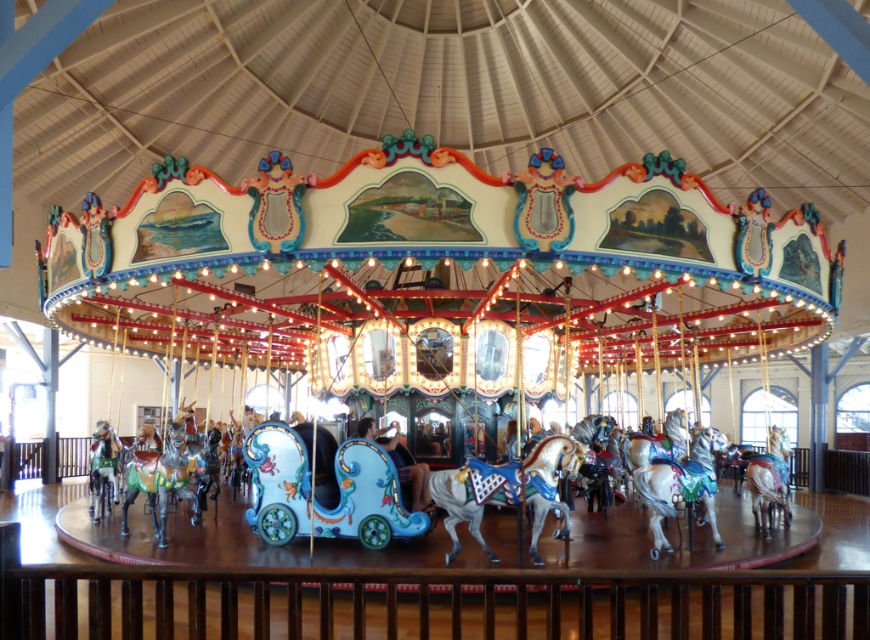
You are a visitor standing at the edge of the carousel, and you want to choose between the shiny silver horse at center and the shiny white horse at center. Which horse do you think has a larger width?

The shiny silver horse at center might be wider than the shiny white horse at center according to the description.

Please describe the object located at point [678,483] in the carousel image.

The object at point [678,483] is a shiny white horse at center.

You are a child who wants to ride the biggest horse on the carousel. Which horse should you choose between the shiny white horse at center and the shiny silver horse at lower left?

The shiny white horse at center is bigger than the shiny silver horse at lower left, so you should choose the shiny white horse at center.